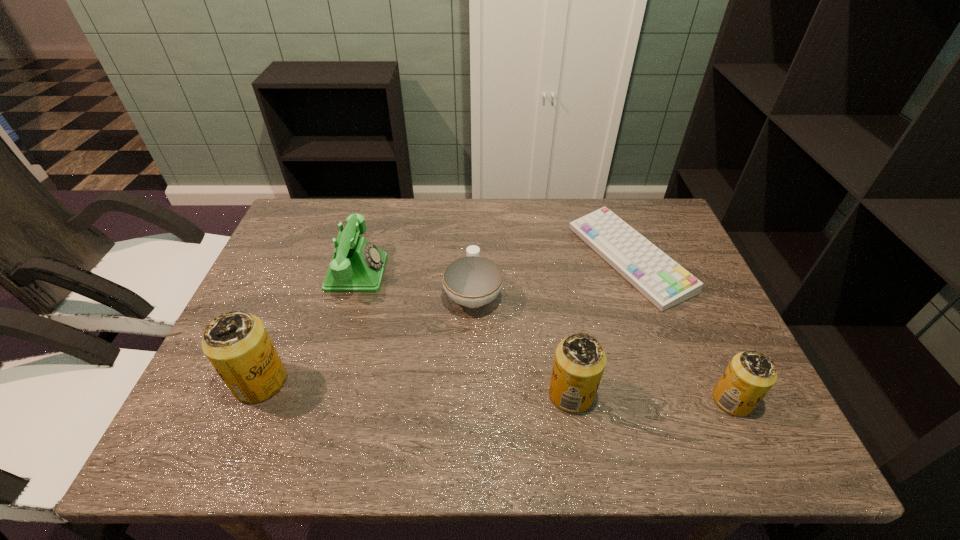
Identify the location of vacant area situated 0.080m on the back of the rightmost beer can. (710, 353).

Where is `vacant space located 0.200m on the left of the computer keyboard`? The image size is (960, 540). vacant space located 0.200m on the left of the computer keyboard is located at coordinates (505, 259).

Where is `vacant space located on the dial of the second object from left to right`? The width and height of the screenshot is (960, 540). vacant space located on the dial of the second object from left to right is located at coordinates point(516,273).

Find the location of a particular element. This screenshot has height=540, width=960. free space located on the side with the handle of the fifth tallest object is located at coordinates (474, 245).

You are a GUI agent. You are given a task and a screenshot of the screen. Output one action in this format:
    pyautogui.click(x=<x>, y=<y>)
    Task: Click on the vacant space located on the side with the handle of the fifth tallest object
    This screenshot has height=540, width=960.
    Given the screenshot: What is the action you would take?
    pyautogui.click(x=474, y=222)

Locate an element on the screen. free space located 0.160m on the side with the handle of the fifth tallest object is located at coordinates (474, 232).

At what (x,y) coordinates should I click in order to perform the action: click on computer keyboard at the far edge. Please return your answer as a coordinate pair (x, y). Looking at the image, I should click on (665, 283).

Find the location of a particular element. telephone that is at the far edge is located at coordinates (357, 266).

Find the location of `object at the left edge`. object at the left edge is located at coordinates (237, 344).

At what (x,y) coordinates should I click in order to perform the action: click on beer can at the right edge. Please return your answer as a coordinate pair (x, y). The height and width of the screenshot is (540, 960). Looking at the image, I should click on (749, 376).